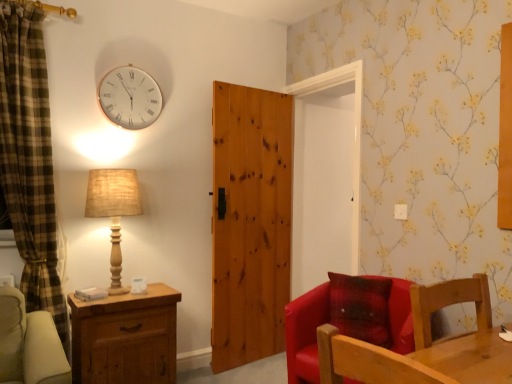
Question: Considering the relative positions of white glass clock at upper left and brown wooden chest of drawers at lower left in the image provided, is white glass clock at upper left in front of brown wooden chest of drawers at lower left?

Choices:
 (A) yes
 (B) no

Answer: (B)

Question: Is white glass clock at upper left outside brown wooden chest of drawers at lower left?

Choices:
 (A) yes
 (B) no

Answer: (A)

Question: Would you say brown wooden chest of drawers at lower left is part of white glass clock at upper left's contents?

Choices:
 (A) no
 (B) yes

Answer: (A)

Question: Can you confirm if white glass clock at upper left is positioned to the right of brown wooden chest of drawers at lower left?

Choices:
 (A) yes
 (B) no

Answer: (B)

Question: From a real-world perspective, is white glass clock at upper left below brown wooden chest of drawers at lower left?

Choices:
 (A) no
 (B) yes

Answer: (A)

Question: Considering the relative positions of white glass clock at upper left and brown wooden chest of drawers at lower left in the image provided, is white glass clock at upper left to the left of brown wooden chest of drawers at lower left from the viewer's perspective?

Choices:
 (A) no
 (B) yes

Answer: (B)

Question: Does brown wooden chest of drawers at lower left touch wooden chair at lower right, arranged as the first chair when viewed from the front?

Choices:
 (A) no
 (B) yes

Answer: (A)

Question: Is wooden chair at lower right, which is counted as the second chair, starting from the back, located within brown wooden chest of drawers at lower left?

Choices:
 (A) yes
 (B) no

Answer: (B)

Question: Does brown wooden chest of drawers at lower left appear on the right side of wooden chair at lower right, which is counted as the second chair, starting from the back?

Choices:
 (A) no
 (B) yes

Answer: (A)

Question: From the image's perspective, is brown wooden chest of drawers at lower left on top of wooden chair at lower right, which is counted as the second chair, starting from the back?

Choices:
 (A) no
 (B) yes

Answer: (A)

Question: Does brown wooden chest of drawers at lower left have a smaller size compared to wooden chair at lower right, arranged as the first chair when viewed from the front?

Choices:
 (A) no
 (B) yes

Answer: (A)

Question: Is brown wooden chest of drawers at lower left looking in the opposite direction of wooden chair at lower right, arranged as the first chair when viewed from the front?

Choices:
 (A) no
 (B) yes

Answer: (A)

Question: From the image's perspective, is wooden chair at lower right, which is counted as the second chair, starting from the back, under brown wooden chest of drawers at lower left?

Choices:
 (A) yes
 (B) no

Answer: (B)